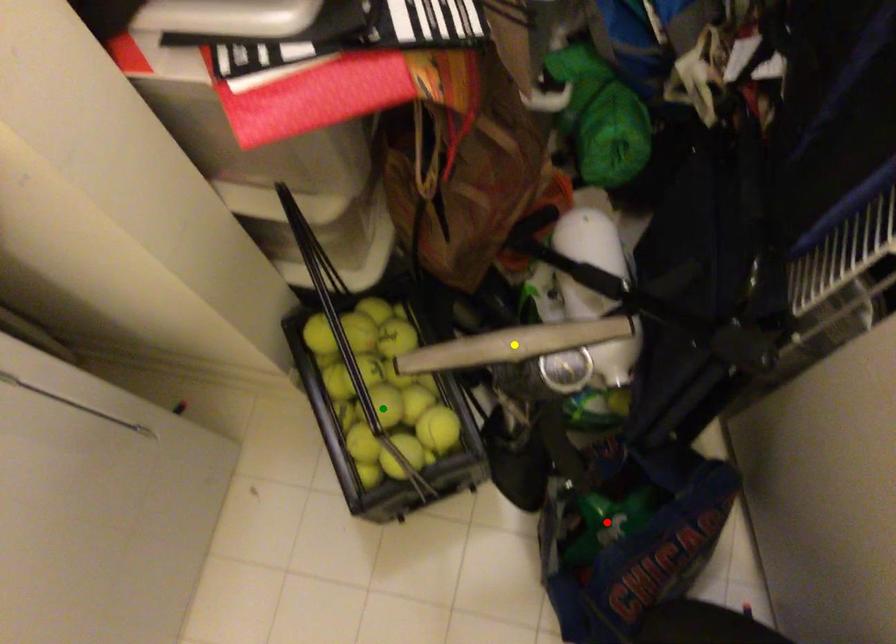
Order these from nearest to farthest:
red point | green point | yellow point

1. yellow point
2. green point
3. red point